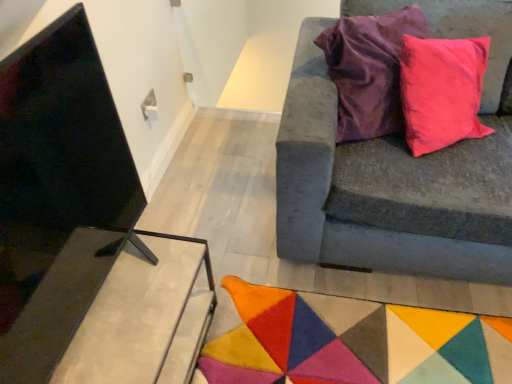
Question: Would you say metallic concrete table at lower left is to the left or to the right of velvet gray couch at right in the picture?

Choices:
 (A) right
 (B) left

Answer: (B)

Question: From the image's perspective, relative to velvet gray couch at right, is metallic concrete table at lower left above or below?

Choices:
 (A) below
 (B) above

Answer: (A)

Question: Considering the real-world distances, which object is closest to the metallic concrete table at lower left?

Choices:
 (A) multicolored felt mat at lower center
 (B) velvet gray couch at right

Answer: (A)

Question: Which object is the farthest from the metallic concrete table at lower left?

Choices:
 (A) velvet gray couch at right
 (B) multicolored felt mat at lower center

Answer: (A)